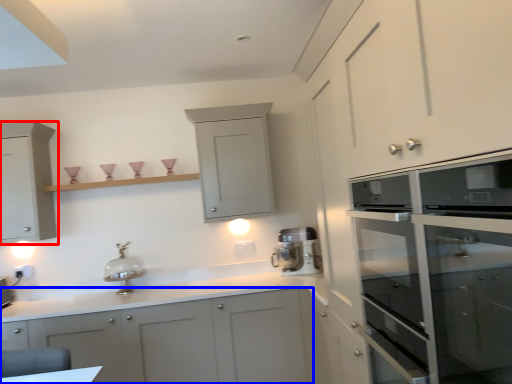
Question: Among these objects, which one is nearest to the camera, cabinetry (highlighted by a red box) or cabinetry (highlighted by a blue box)?

Choices:
 (A) cabinetry
 (B) cabinetry

Answer: (B)